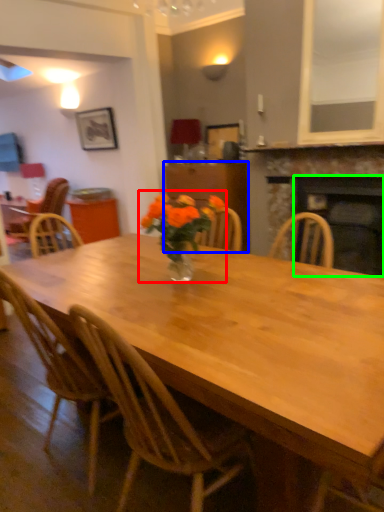
Question: Which object is positioned closest to floral arrangement (highlighted by a red box)? Select from cabinetry (highlighted by a blue box) and fireplace (highlighted by a green box).

Choices:
 (A) cabinetry
 (B) fireplace

Answer: (B)